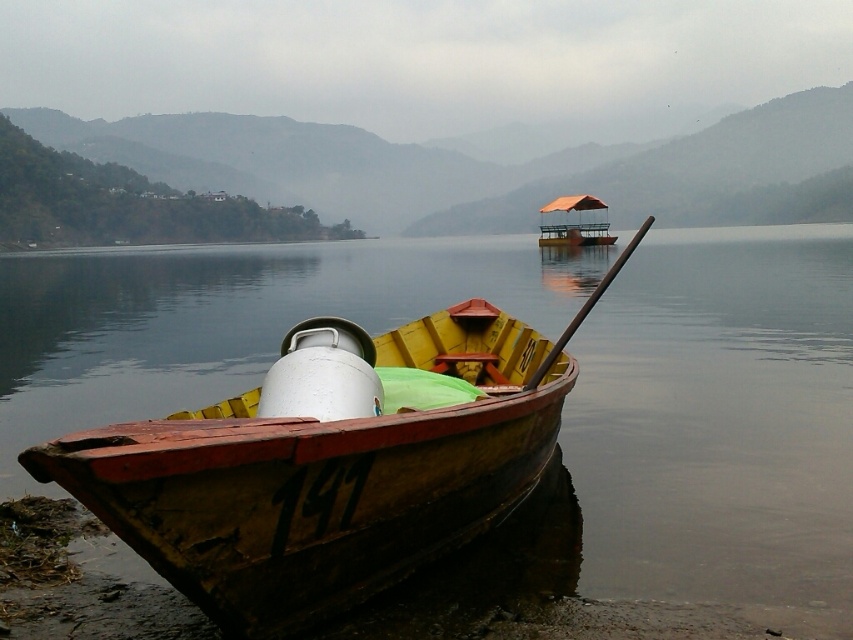
You are standing at the point marked by coordinates point (329, 465). Looking around, you see the wooden boat at lower left and the larger boat with orange canopy in the background. Which boat is closer to your current position?

The wooden boat at lower left is closer to your current position because the point (329, 465) marks its location, indicating it is right where you are standing.

You are an observer standing at the lakeside. You see the wooden boat at lower left and the orange canvas boat at center. Which boat is taller?

The orange canvas boat at center is taller than the wooden boat at lower left.